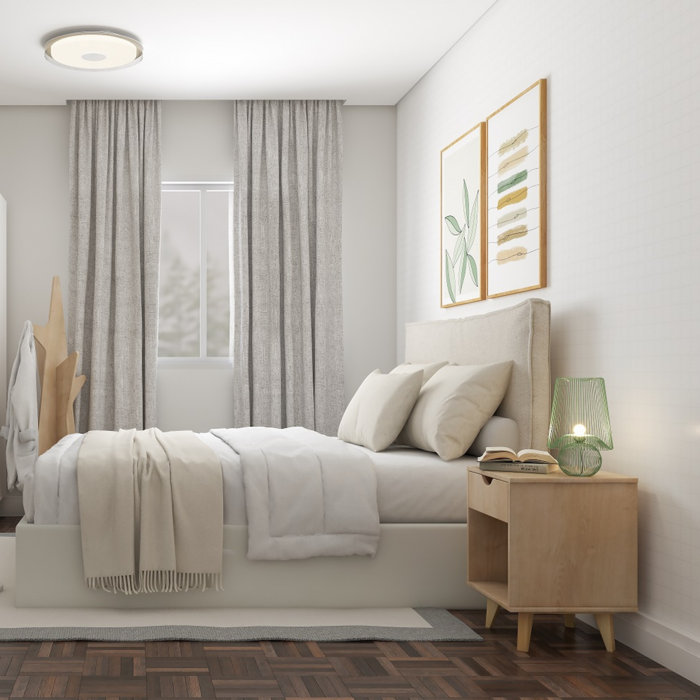
Find the location of `ceiling light`. ceiling light is located at coordinates (69, 36), (96, 57), (122, 61).